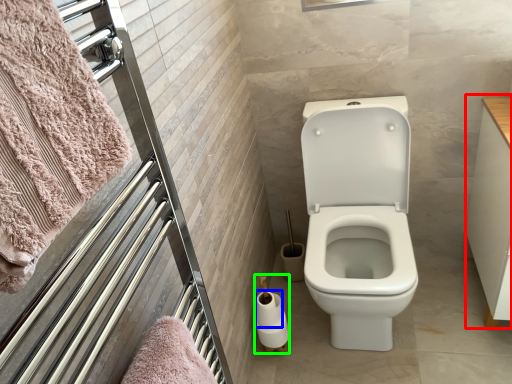
Question: Which object is the closest to the drawer (highlighted by a red box)? Choose among these: toilet paper (highlighted by a blue box) or toilet paper (highlighted by a green box).

Choices:
 (A) toilet paper
 (B) toilet paper

Answer: (B)